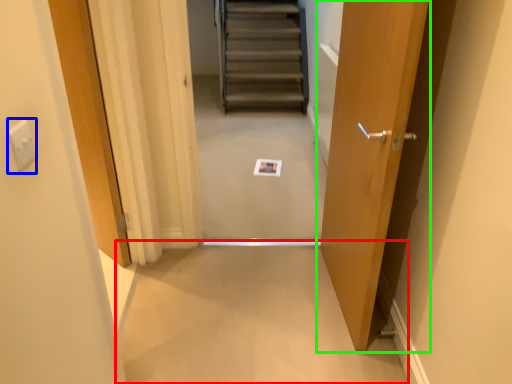
Question: Estimate the real-world distances between objects in this image. Which object is closer to plain (highlighted by a red box), electric outlet (highlighted by a blue box) or door (highlighted by a green box)?

Choices:
 (A) electric outlet
 (B) door

Answer: (B)